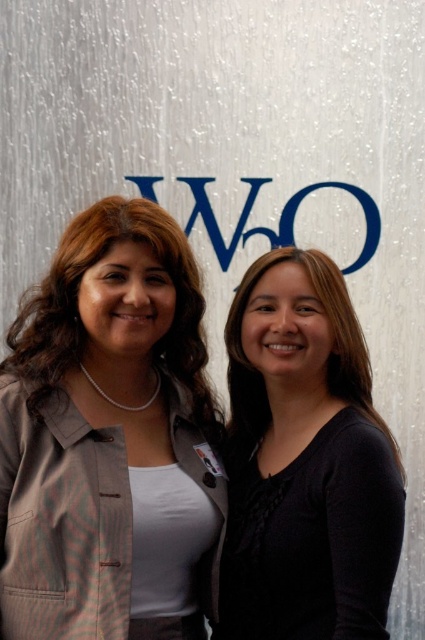
Question: Is black matte shirt at center to the left of matte brown hair at left from the viewer's perspective?

Choices:
 (A) no
 (B) yes

Answer: (A)

Question: Is black matte shirt at center positioned in front of matte brown hair at left?

Choices:
 (A) yes
 (B) no

Answer: (A)

Question: Which point is farther from the camera taking this photo?

Choices:
 (A) (331, 458)
 (B) (73, 250)

Answer: (B)

Question: Does black matte shirt at center have a smaller size compared to matte brown hair at left?

Choices:
 (A) no
 (B) yes

Answer: (A)

Question: Which of the following is the closest to the observer?

Choices:
 (A) black matte shirt at center
 (B) matte brown hair at left

Answer: (A)